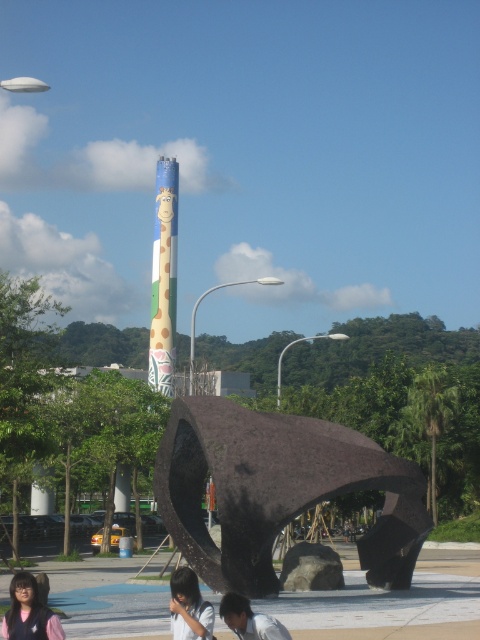
Question: Among these points, which one is nearest to the camera?

Choices:
 (A) (236, 488)
 (B) (225, 609)

Answer: (B)

Question: Where is dark brown stone sculpture at center located in relation to white matte shirt at lower center in the image?

Choices:
 (A) below
 (B) above

Answer: (A)

Question: Does multicolored painted totem pole at center have a smaller size compared to matte black hair at lower left?

Choices:
 (A) yes
 (B) no

Answer: (B)

Question: Is matte black hair at lower left wider than white matte shirt at lower center?

Choices:
 (A) no
 (B) yes

Answer: (B)

Question: Which point is farther to the camera?

Choices:
 (A) (196, 625)
 (B) (36, 604)
 (C) (325, 428)
 (D) (160, 388)

Answer: (D)

Question: Which of the following is the closest to the observer?

Choices:
 (A) (231, 612)
 (B) (188, 584)
 (C) (216, 401)
 (D) (163, 294)

Answer: (A)